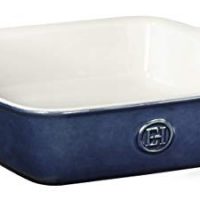
Locate an element on the screen. Image resolution: width=200 pixels, height=200 pixels. non stick interior of bowl is located at coordinates (132, 53).